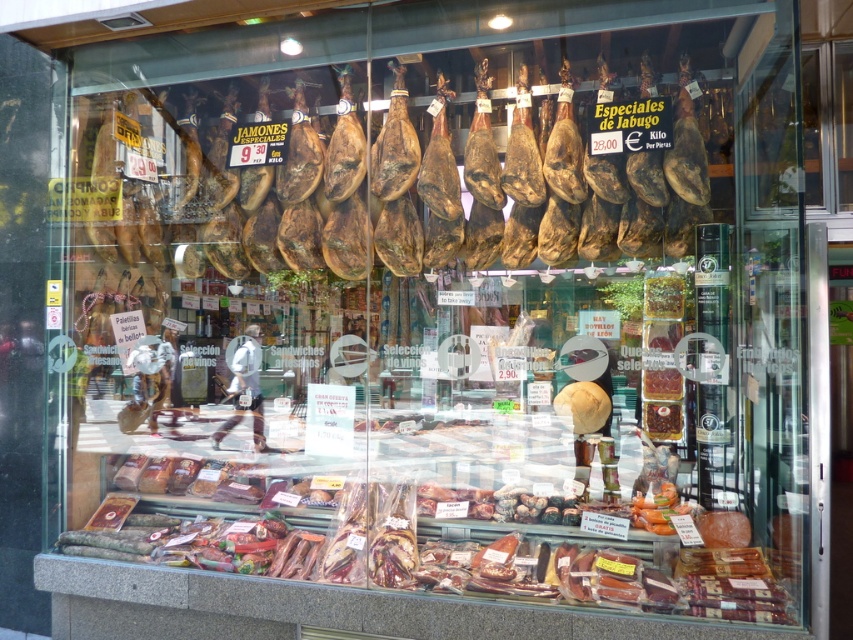
Question: Is brown leather ham at center thinner than shiny brown meat at center?

Choices:
 (A) no
 (B) yes

Answer: (B)

Question: Which point appears closest to the camera in this image?

Choices:
 (A) (276, 209)
 (B) (281, 456)

Answer: (A)

Question: Which point is closer to the camera taking this photo?

Choices:
 (A) (148, 180)
 (B) (552, 509)

Answer: (B)

Question: Does brown leather ham at center have a greater width compared to shiny brown meat at center?

Choices:
 (A) no
 (B) yes

Answer: (A)

Question: Which point is closer to the camera?

Choices:
 (A) (325, 192)
 (B) (392, 464)

Answer: (A)

Question: Does brown leather ham at center come in front of shiny brown meat at center?

Choices:
 (A) no
 (B) yes

Answer: (A)